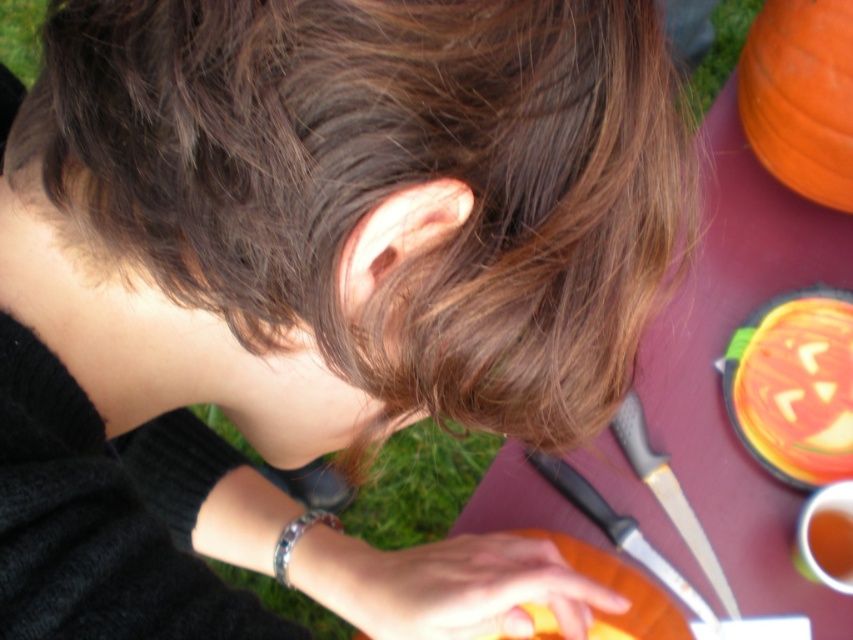
Question: Can you confirm if orange carved pumpkin at lower right is thinner than orange matte pumpkin at lower center?

Choices:
 (A) yes
 (B) no

Answer: (A)

Question: Which object is farther from the camera taking this photo?

Choices:
 (A) orange carved pumpkin at lower right
 (B) orange matte pumpkin at upper right

Answer: (A)

Question: Does orange carved pumpkin at lower right have a lesser width compared to orange matte pumpkin at lower center?

Choices:
 (A) yes
 (B) no

Answer: (A)

Question: Which object is farther from the camera taking this photo?

Choices:
 (A) orange carved pumpkin at lower right
 (B) orange matte pumpkin at lower center
 (C) orange matte pumpkin at upper right

Answer: (A)

Question: Based on their relative distances, which object is farther from the orange carved pumpkin at lower right?

Choices:
 (A) orange matte pumpkin at lower center
 (B) orange matte pumpkin at upper right

Answer: (A)

Question: Does orange carved pumpkin at lower right appear under orange matte pumpkin at upper right?

Choices:
 (A) yes
 (B) no

Answer: (A)